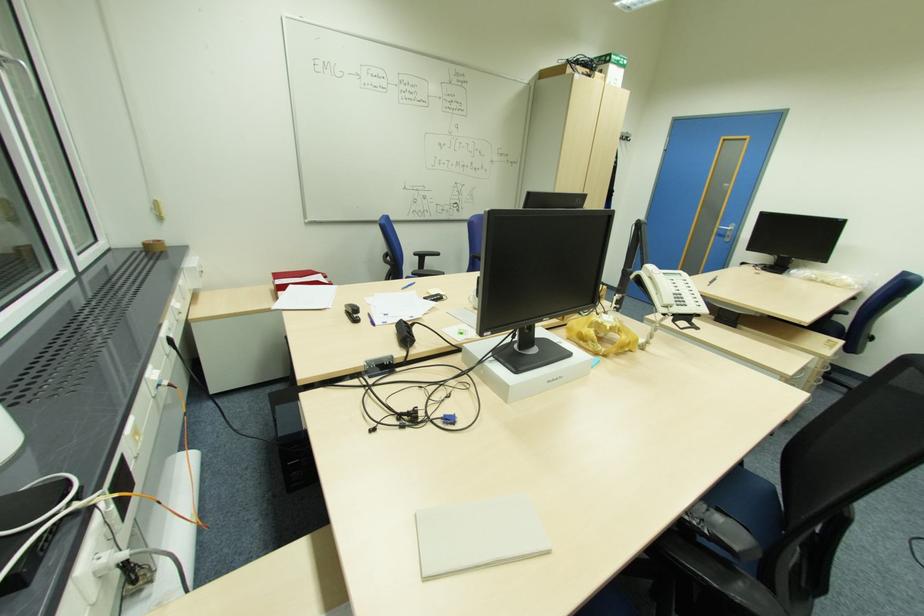
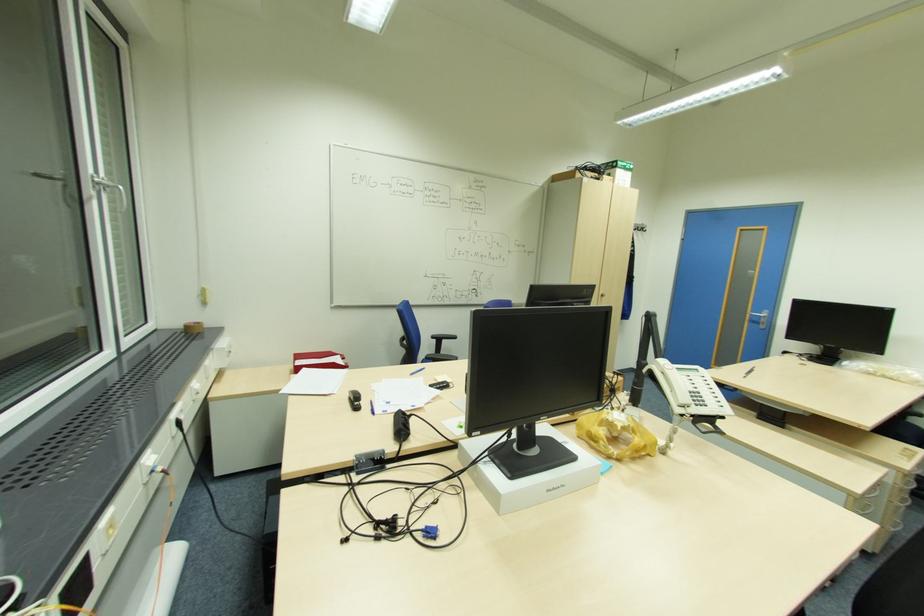
The point at (162,241) is marked in the first image. Where is the corresponding point in the second image?

(201, 323)